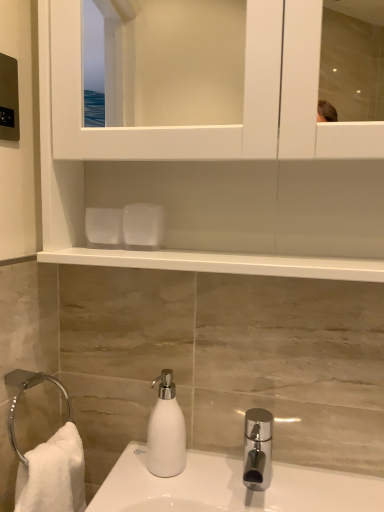
Question: Does white matte soap dispenser at lower center have a larger size compared to white matte cabinet at upper center?

Choices:
 (A) no
 (B) yes

Answer: (A)

Question: Is white matte soap dispenser at lower center further to the viewer compared to white matte cabinet at upper center?

Choices:
 (A) no
 (B) yes

Answer: (B)

Question: Considering the relative sizes of white matte soap dispenser at lower center and white matte cabinet at upper center in the image provided, is white matte soap dispenser at lower center taller than white matte cabinet at upper center?

Choices:
 (A) no
 (B) yes

Answer: (A)

Question: From a real-world perspective, is white matte soap dispenser at lower center positioned under white matte cabinet at upper center based on gravity?

Choices:
 (A) no
 (B) yes

Answer: (B)

Question: Is white matte cabinet at upper center surrounded by white matte soap dispenser at lower center?

Choices:
 (A) yes
 (B) no

Answer: (B)

Question: Is white matte soap dispenser at lower center at the left side of white matte cabinet at upper center?

Choices:
 (A) yes
 (B) no

Answer: (A)

Question: Can you confirm if white matte cabinet at upper center is thinner than white matte soap dispenser at lower center?

Choices:
 (A) yes
 (B) no

Answer: (B)

Question: Is white matte cabinet at upper center not near white matte soap dispenser at lower center?

Choices:
 (A) yes
 (B) no

Answer: (B)

Question: Is white matte cabinet at upper center wider than white matte soap dispenser at lower center?

Choices:
 (A) no
 (B) yes

Answer: (B)

Question: Is white matte cabinet at upper center bigger than white matte soap dispenser at lower center?

Choices:
 (A) yes
 (B) no

Answer: (A)

Question: Is white matte cabinet at upper center located outside white matte soap dispenser at lower center?

Choices:
 (A) no
 (B) yes

Answer: (B)

Question: Is white matte cabinet at upper center positioned in front of white matte soap dispenser at lower center?

Choices:
 (A) yes
 (B) no

Answer: (A)

Question: From their relative heights in the image, would you say white matte cabinet at upper center is taller or shorter than white matte soap dispenser at lower center?

Choices:
 (A) short
 (B) tall

Answer: (B)